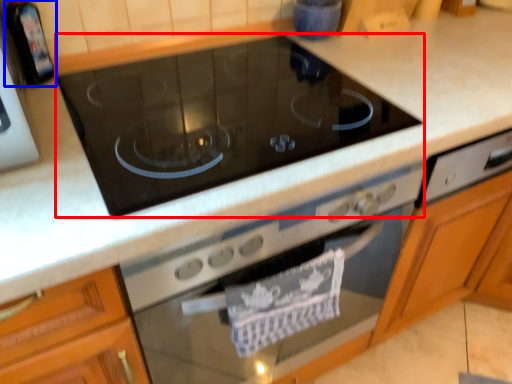
Question: Which object is closer to the camera taking this photo, gas stove (highlighted by a red box) or appliance (highlighted by a blue box)?

Choices:
 (A) gas stove
 (B) appliance

Answer: (A)